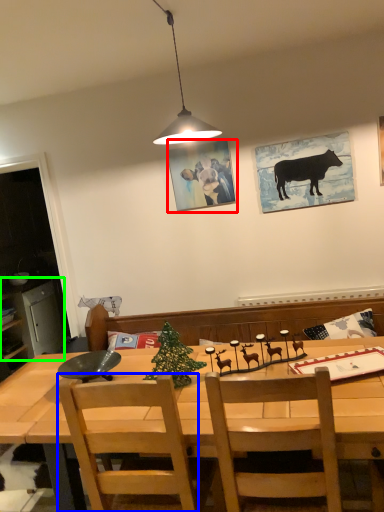
Question: Estimate the real-world distances between objects in this image. Which object is closer to picture frame (highlighted by a red box), chair (highlighted by a blue box) or cabinetry (highlighted by a green box)?

Choices:
 (A) chair
 (B) cabinetry

Answer: (A)